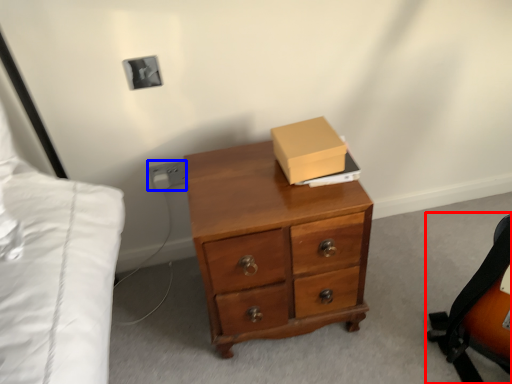
Question: Which object is closer to the camera taking this photo, messenger bag (highlighted by a red box) or electric outlet (highlighted by a blue box)?

Choices:
 (A) messenger bag
 (B) electric outlet

Answer: (A)